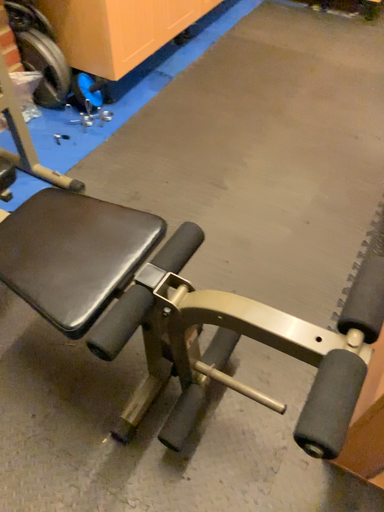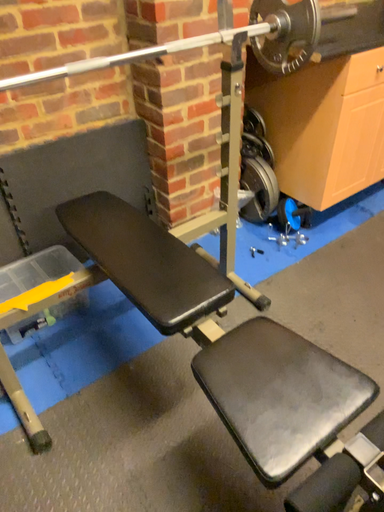
Question: How did the camera likely rotate when shooting the video?

Choices:
 (A) rotated upward
 (B) rotated downward

Answer: (A)